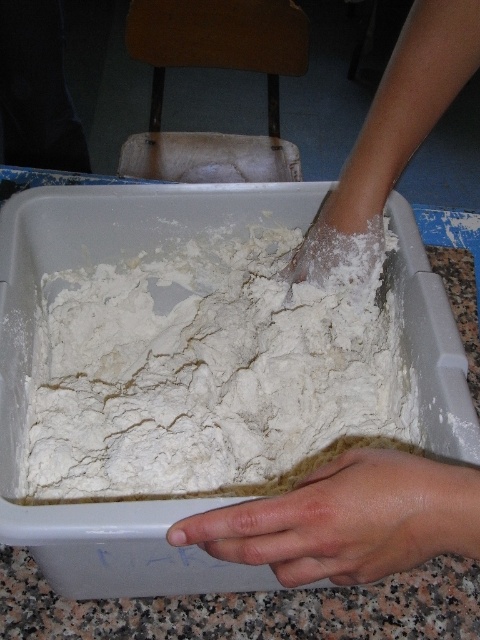
Question: Which point is closer to the camera?

Choices:
 (A) dry skin at lower center
 (B) white powdery flour at center

Answer: (A)

Question: Does white powdery flour at center have a smaller size compared to dry skin at lower center?

Choices:
 (A) no
 (B) yes

Answer: (A)

Question: Which point appears farthest from the camera in this image?

Choices:
 (A) (340, 538)
 (B) (285, 308)

Answer: (B)

Question: Which point appears farthest from the camera in this image?

Choices:
 (A) (214, 296)
 (B) (420, 492)

Answer: (A)

Question: Where is white powdery flour at center located in relation to dry skin at lower center in the image?

Choices:
 (A) right
 (B) left

Answer: (B)

Question: Is white powdery flour at center smaller than dry skin at lower center?

Choices:
 (A) yes
 (B) no

Answer: (B)